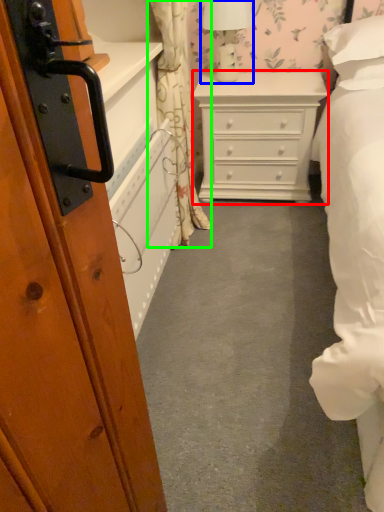
Question: Considering the real-world distances, which object is farthest from chest of drawers (highlighted by a red box)? table lamp (highlighted by a blue box) or curtain (highlighted by a green box)?

Choices:
 (A) table lamp
 (B) curtain

Answer: (B)